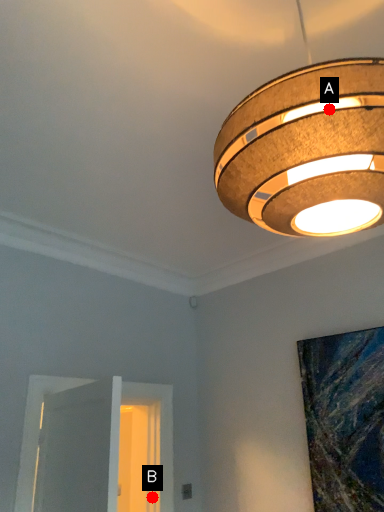
Question: Two points are circled on the image, labeled by A and B beside each circle. Which point is further to the camera?

Choices:
 (A) A is further
 (B) B is further

Answer: (B)